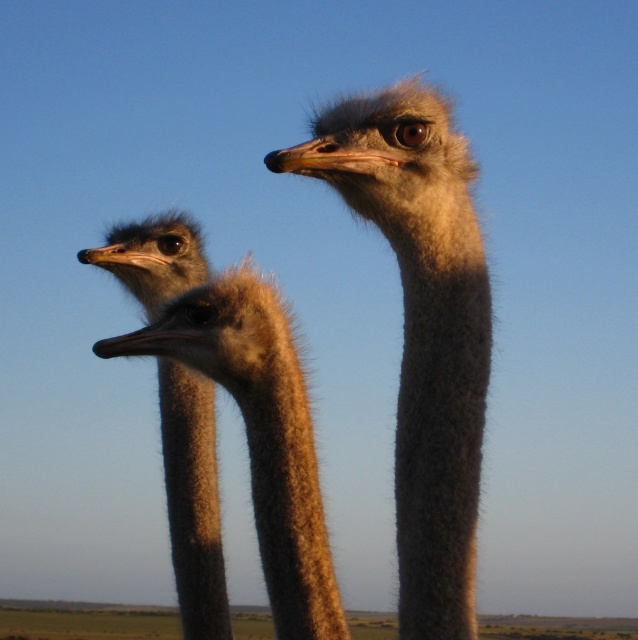
Can you confirm if gray fluffy ostrich head at center is positioned above brown fuzzy head at left?

Indeed, gray fluffy ostrich head at center is positioned over brown fuzzy head at left.

At what (x,y) coordinates should I click in order to perform the action: click on gray fluffy ostrich head at center. Please return your answer as a coordinate pair (x, y). The width and height of the screenshot is (638, 640). Looking at the image, I should click on (420, 326).